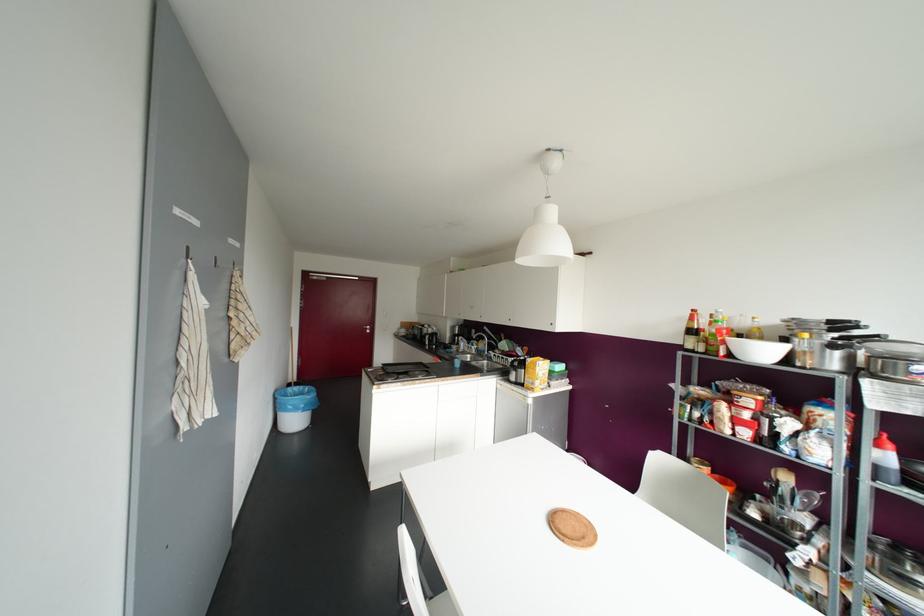
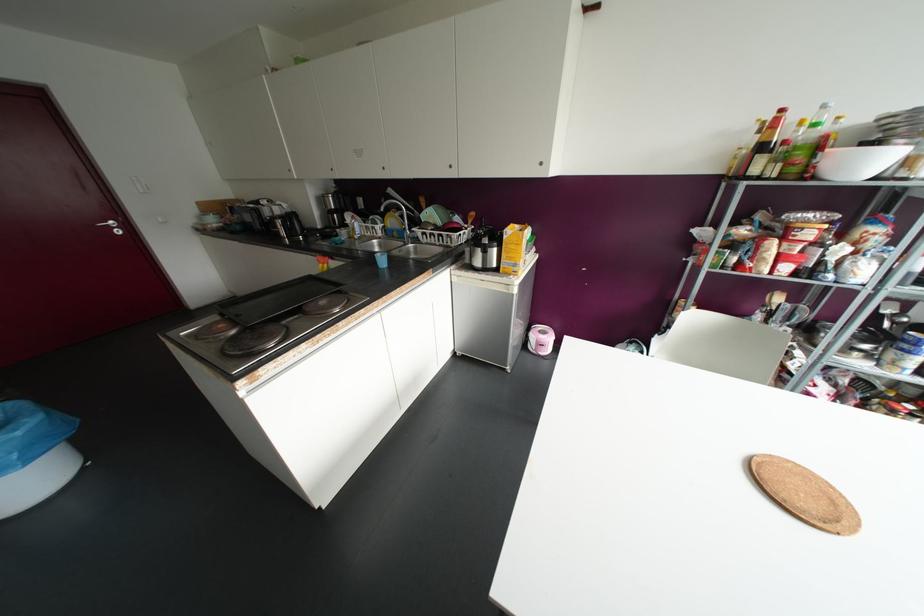
In the second image, find the point that corresponds to [368,331] in the first image.

(117, 232)